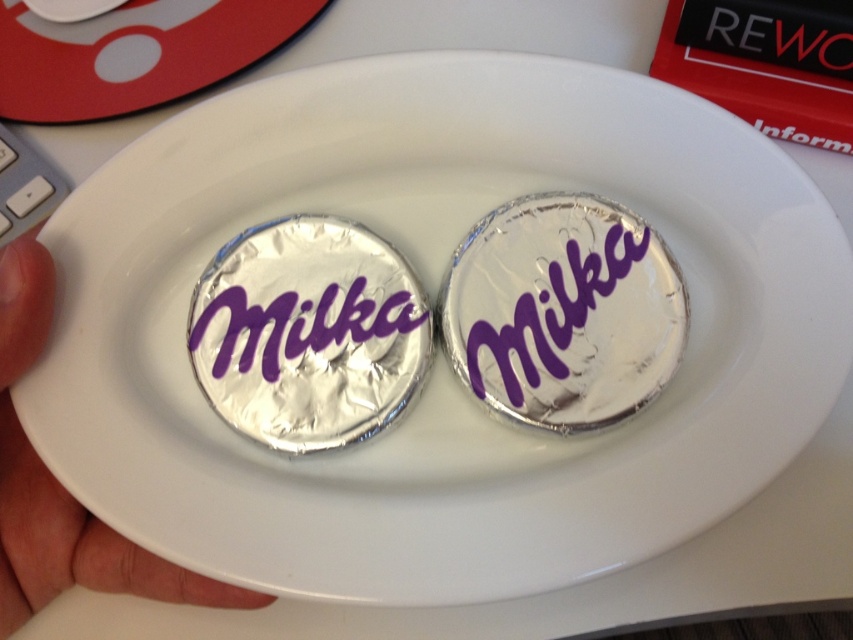
Who is taller, red matte mouse pad at upper left or skinny white hand at center?

skinny white hand at center

Identify the location of red matte mouse pad at upper left. The height and width of the screenshot is (640, 853). (134, 52).

At what (x,y) coordinates should I click in order to perform the action: click on red matte mouse pad at upper left. Please return your answer as a coordinate pair (x, y). This screenshot has height=640, width=853. Looking at the image, I should click on (134, 52).